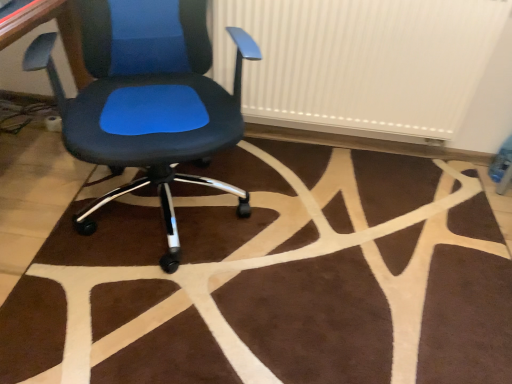
Question: Does point 458,231 appear closer or farther from the camera than point 338,87?

Choices:
 (A) farther
 (B) closer

Answer: (B)

Question: Is brown plush rug at center taller or shorter than white ribbed radiator at upper center?

Choices:
 (A) short
 (B) tall

Answer: (A)

Question: Which object is positioned closest to the matte black office chair at center?

Choices:
 (A) brown plush rug at center
 (B) white ribbed radiator at upper center

Answer: (B)

Question: Which object is positioned farthest from the brown plush rug at center?

Choices:
 (A) matte black office chair at center
 (B) white ribbed radiator at upper center

Answer: (B)